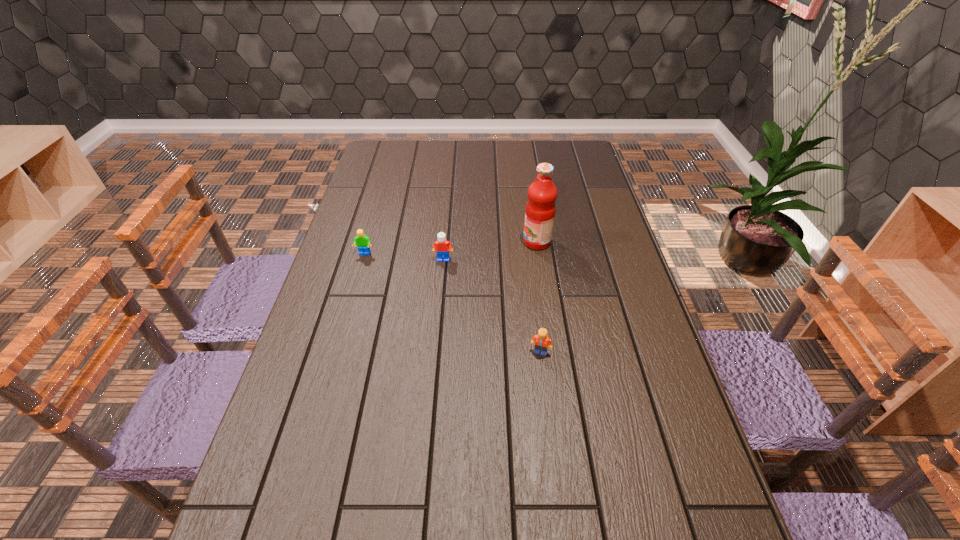
Identify the location of vacant space that satisfies the following two spatial constraints: 1. on the front label of the tallest object; 2. on the face of the leftmost Lego. (539, 254).

The height and width of the screenshot is (540, 960). In order to click on vacant space that satisfies the following two spatial constraints: 1. on the front label of the fruit juice; 2. on the front-facing side of the nearest object in this screenshot , I will do `click(553, 353)`.